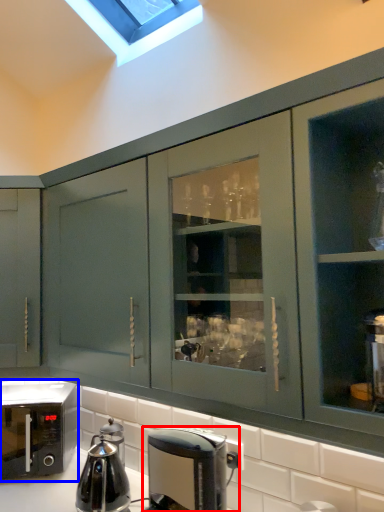
Question: Which object is closer to the camera taking this photo, coffee maker (highlighted by a red box) or home appliance (highlighted by a blue box)?

Choices:
 (A) coffee maker
 (B) home appliance

Answer: (A)